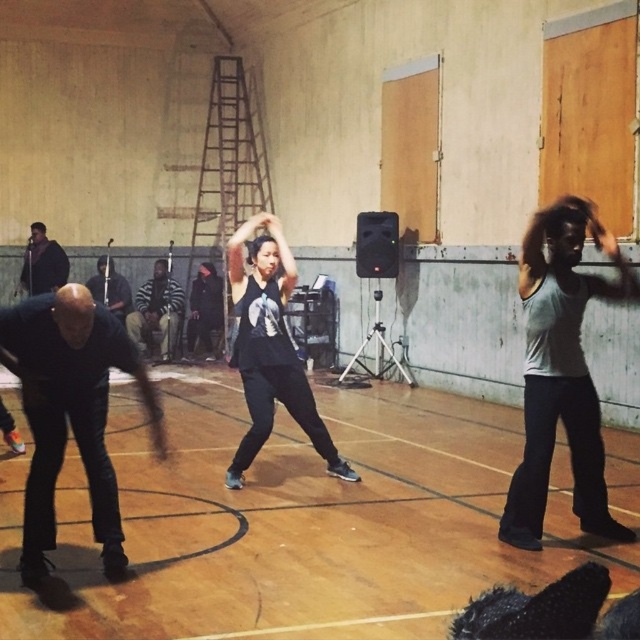
Is wooden floor at center to the left of gray matte tank top at right from the viewer's perspective?

In fact, wooden floor at center is to the right of gray matte tank top at right.

Which is behind, point (474, 593) or point (580, 380)?

Positioned behind is point (580, 380).

You are a GUI agent. You are given a task and a screenshot of the screen. Output one action in this format:
    pyautogui.click(x=<x>, y=<y>)
    Task: Click on the wooden floor at center
    The image size is (640, 640).
    Given the screenshot: What is the action you would take?
    pyautogui.click(x=300, y=522)

Is point (618, 531) more distant than point (256, 310)?

No, it is not.

Does gray matte tank top at right lie in front of black matte tank top at center?

That is True.

Where is `gray matte tank top at right`? This screenshot has width=640, height=640. gray matte tank top at right is located at coordinates 561,372.

Looking at this image, who is shorter, black matte tank top at center or dark brown leather jacket at left?

dark brown leather jacket at left is shorter.

Is point (262, 323) closer to viewer compared to point (52, 291)?

Yes, point (262, 323) is closer to viewer.

You are a GUI agent. You are given a task and a screenshot of the screen. Output one action in this format:
    pyautogui.click(x=<x>, y=<y>)
    Task: Click on the black matte tank top at center
    The height and width of the screenshot is (640, 640).
    Given the screenshot: What is the action you would take?
    pyautogui.click(x=269, y=348)